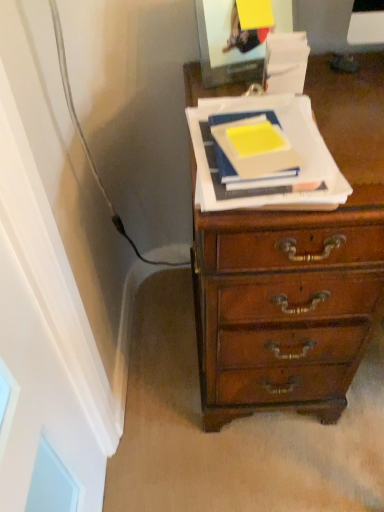
Locate an element on the screen. vacant space in front of yellow matte paper at center, the 2th paperback book from the right is located at coordinates (272, 189).